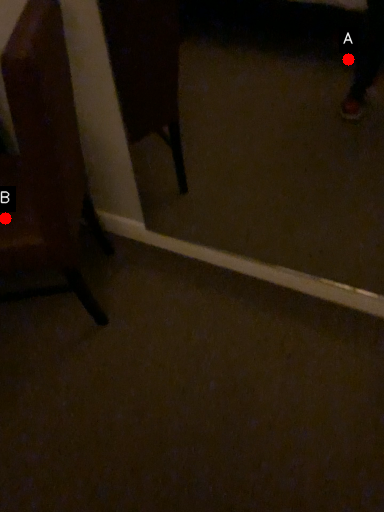
Question: Two points are circled on the image, labeled by A and B beside each circle. Which point is farther to the camera?

Choices:
 (A) A is further
 (B) B is further

Answer: (A)